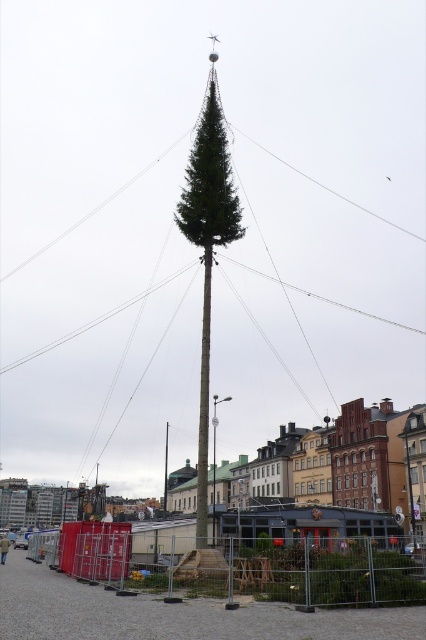
In the scene shown: Between green matte tree at center and green matte pole at center, which one appears on the right side from the viewer's perspective?

Positioned to the right is green matte tree at center.

Who is more forward, (206, 198) or (166, 477)?

Positioned in front is point (206, 198).

Identify the location of green matte tree at center. The height and width of the screenshot is (640, 426). (207, 246).

The image size is (426, 640). I want to click on green matte tree at center, so click(207, 246).